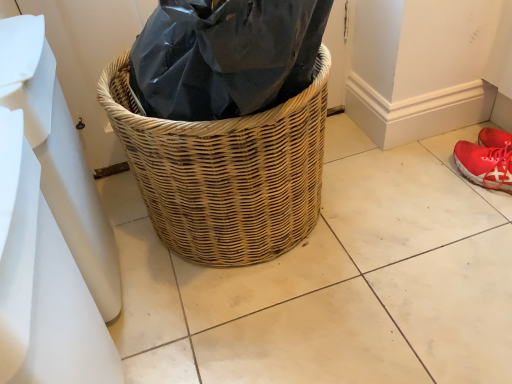
Identify the location of unoccupied region to the right of woven natural basket at center. (406, 206).